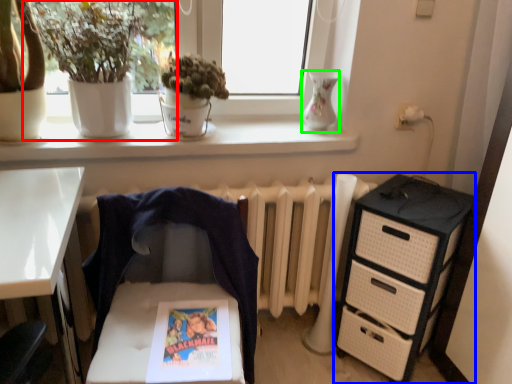
Question: Based on their relative distances, which object is nearer to houseplant (highlighted by a red box)? Choose from chest of drawers (highlighted by a blue box) and vase (highlighted by a green box).

Choices:
 (A) chest of drawers
 (B) vase

Answer: (B)